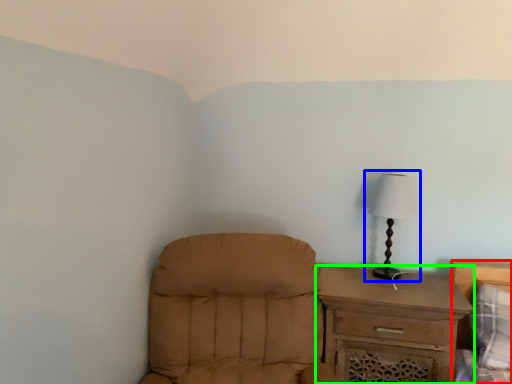
Question: Considering the real-world distances, which object is farthest from bed (highlighted by a red box)? lamp (highlighted by a blue box) or chest of drawers (highlighted by a green box)?

Choices:
 (A) lamp
 (B) chest of drawers

Answer: (A)